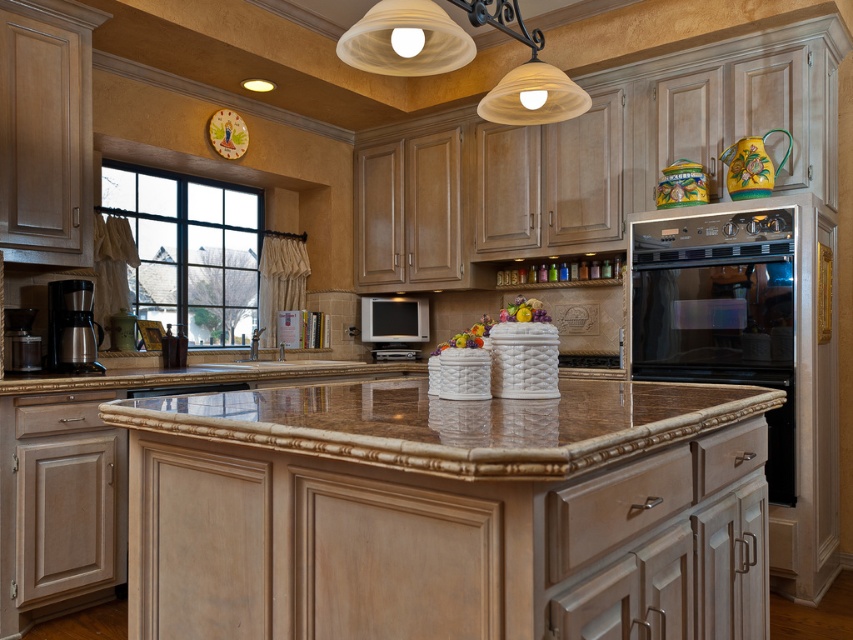
You are a delivery person who just arrived at the kitchen to place a new coffee maker. The new coffee maker is 2 feet wide. You see the brown granite countertop at center and the satin silver coffee maker at left. Is there enough space between them to place the new coffee maker?

The distance between the brown granite countertop at center and the satin silver coffee maker at left is 6.36 feet. Since the new coffee maker is 2 feet wide, there is sufficient space to place it between them.

Looking at this image, you are a chef preparing to move a large cutting board from the brown granite countertop at center to the satin silver oven at right. The cutting board is 1.5 meters long. Can you slide it horizontally across the space between them without lifting it?

The distance between the brown granite countertop at center and the satin silver oven at right is 1.48 meters. Since the cutting board is 1.5 meters long, it cannot be slid horizontally between them without lifting because the distance is shorter than the board.